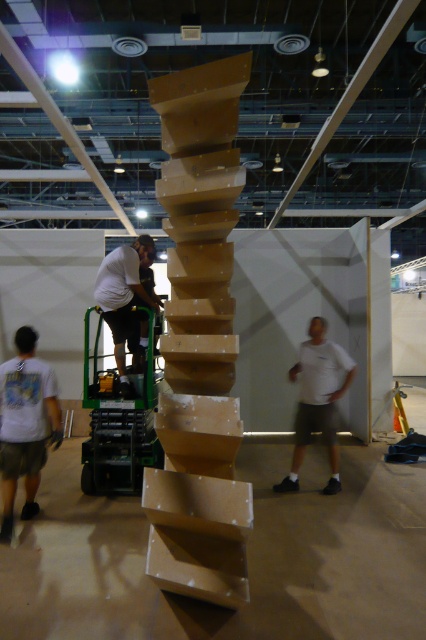
You are standing in the exhibition hall and want to take a photo of the two points mentioned. Which point, point (x=23, y=436) or point (x=109, y=280), will appear larger in your camera view?

Point (x=23, y=436) is closer to the camera than point (x=109, y=280), so it will appear larger in the camera view.